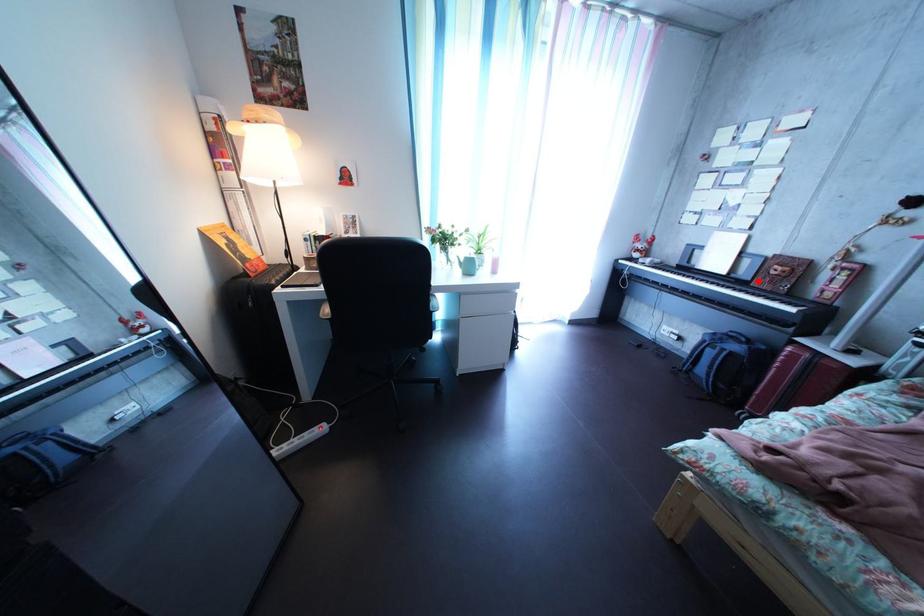
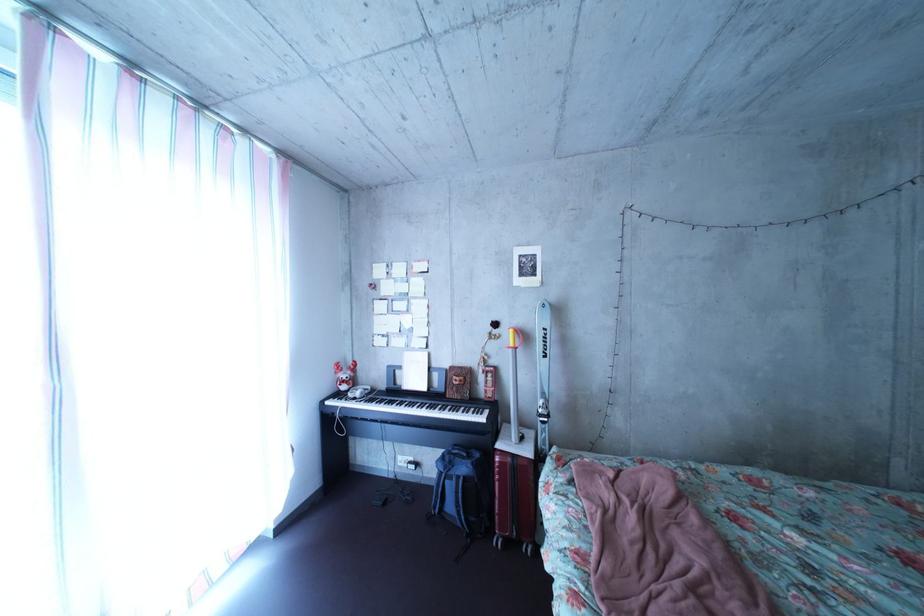
The point at the highlighted location is marked in the first image. Where is the corresponding point in the second image?

(452, 392)